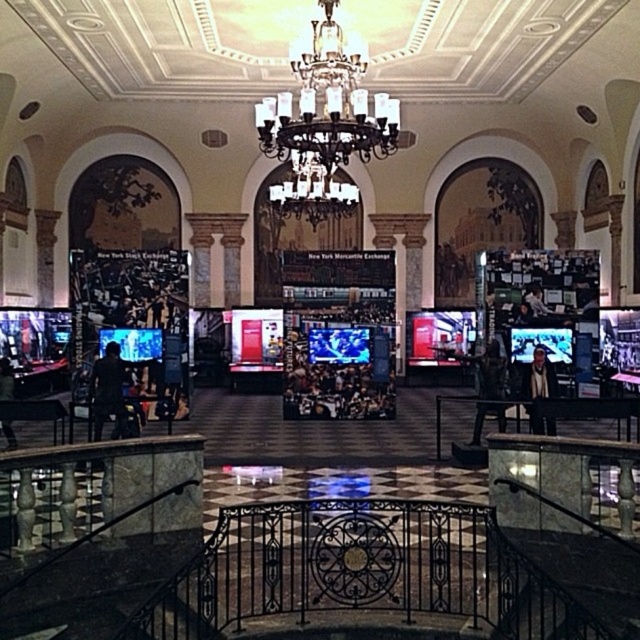
You are a visitor standing at the base of the staircase. You want to hang your black leather jacket at lower left on a hook located near the crystal glass chandelier at center. Can you reach the hook if the maximum distance you can stretch is 9 meters?

The crystal glass chandelier at center is 8.93 meters from the black leather jacket at lower left. Since the maximum stretching distance is 9 meters, you can reach the hook.

You are a visitor standing at the top of the staircase and see the crystal glass chandelier at center and the dark gray suit at center. Which object is taller?

The crystal glass chandelier at center is much taller than the dark gray suit at center.